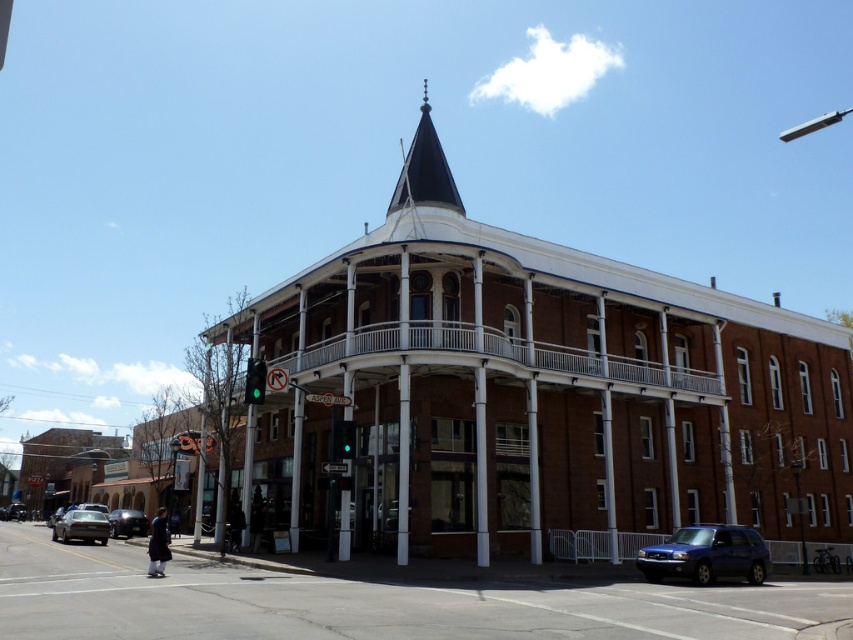
You are a pedestrian waiting at the crosswalk near the Victorian building. You see a metallic silver sedan at lower left and a shiny silver sedan at lower left. Which one is closer to you?

The metallic silver sedan at lower left is closer to you than the shiny silver sedan at lower left.

You are driving a car that is 15 feet long and want to park it in the space between the shiny silver sedan at lower left and the green glass traffic light at center. Can you fit your car in that space?

The distance between the shiny silver sedan at lower left and the green glass traffic light at center is 79.35 feet. Since your car is only 15 feet long, there is plenty of space to park your car in that area.